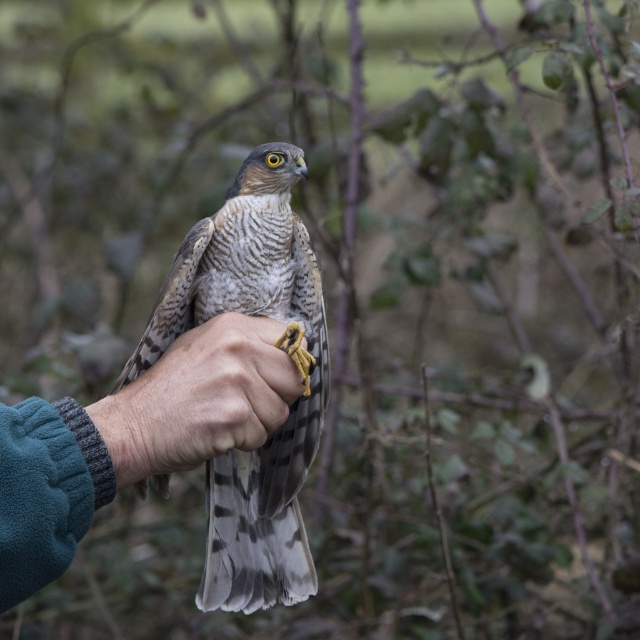
Question: Can you confirm if speckled feathered falcon at center is smaller than teal fleece arm at center?

Choices:
 (A) yes
 (B) no

Answer: (B)

Question: Among these objects, which one is farthest from the camera?

Choices:
 (A) smooth leather glove at center
 (B) teal fleece arm at center

Answer: (A)

Question: Is the position of teal fleece arm at center less distant than that of smooth leather glove at center?

Choices:
 (A) yes
 (B) no

Answer: (A)

Question: Is speckled feathered falcon at center thinner than teal fleece arm at center?

Choices:
 (A) yes
 (B) no

Answer: (B)

Question: Which object is the farthest from the speckled feathered falcon at center?

Choices:
 (A) teal fleece arm at center
 (B) smooth leather glove at center

Answer: (A)

Question: Which object appears farthest from the camera in this image?

Choices:
 (A) smooth leather glove at center
 (B) speckled feathered falcon at center

Answer: (B)